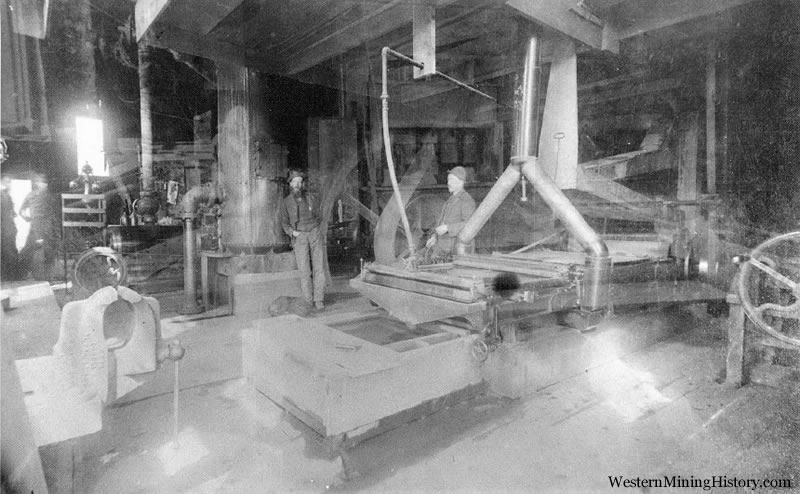
Identify the location of giant pillar. Image resolution: width=800 pixels, height=494 pixels. (242, 107).